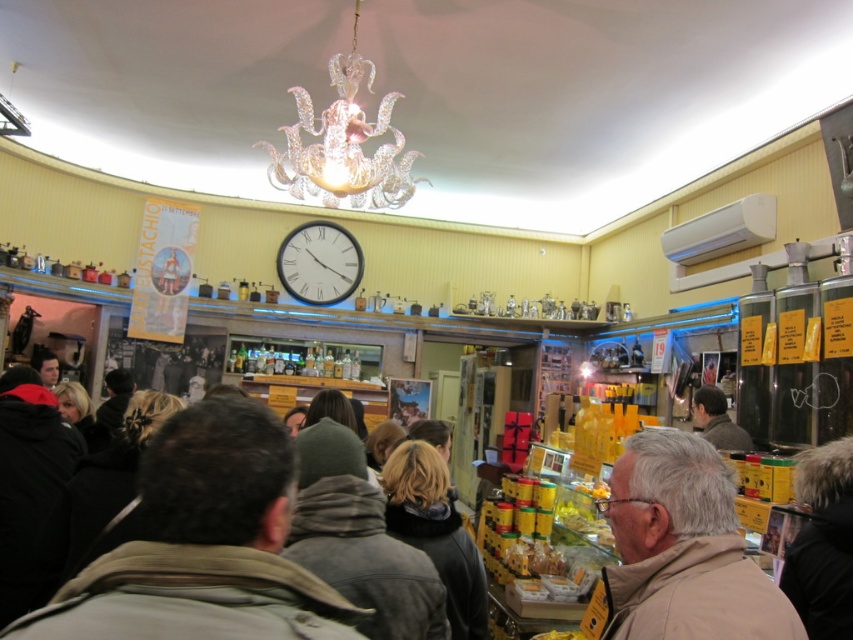
Is brown fuzzy jacket at center thinner than dark brown leather jacket at center?

No.

Locate an element on the screen. The image size is (853, 640). brown fuzzy jacket at center is located at coordinates (358, 540).

Is beige fabric jacket at lower right bigger than pink glass chandelier at upper center?

No.

Is beige fabric jacket at lower right wider than pink glass chandelier at upper center?

In fact, beige fabric jacket at lower right might be narrower than pink glass chandelier at upper center.

The image size is (853, 640). Find the location of `beige fabric jacket at lower right`. beige fabric jacket at lower right is located at coordinates (683, 548).

Where is `beige fabric jacket at lower right`? The image size is (853, 640). beige fabric jacket at lower right is located at coordinates [x=683, y=548].

Who is lower down, brown fuzzy jacket at center or pink glass chandelier at upper center?

brown fuzzy jacket at center is below.

Between point (398, 589) and point (286, 136), which one is positioned behind?

Point (286, 136)

At what (x,y) coordinates should I click in order to perform the action: click on brown fuzzy jacket at center. Please return your answer as a coordinate pair (x, y). The image size is (853, 640). Looking at the image, I should click on (358, 540).